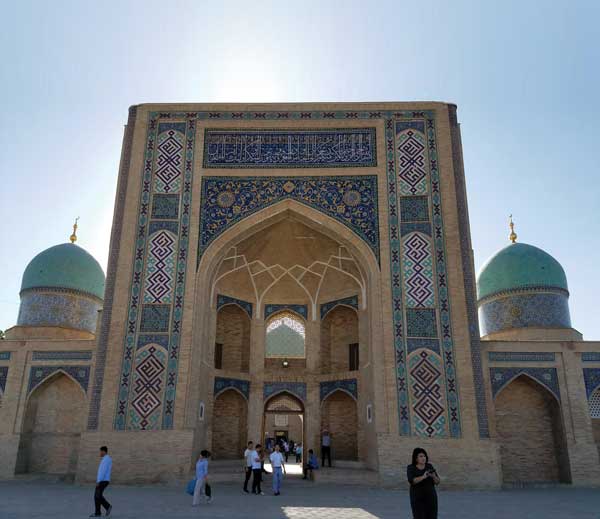
The image size is (600, 519). I want to click on archway, so click(x=154, y=263), click(x=431, y=207).